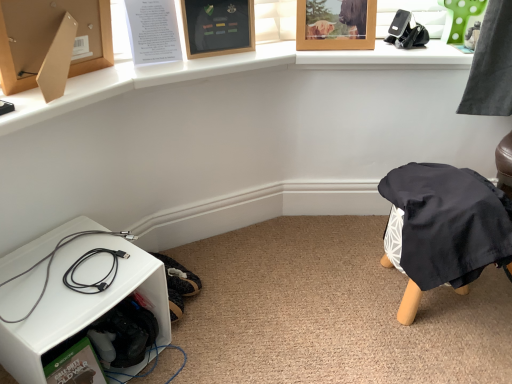
This screenshot has height=384, width=512. In order to click on free space above white plastic shelf at lower left (from a real-world perspective) in this screenshot , I will do `click(66, 269)`.